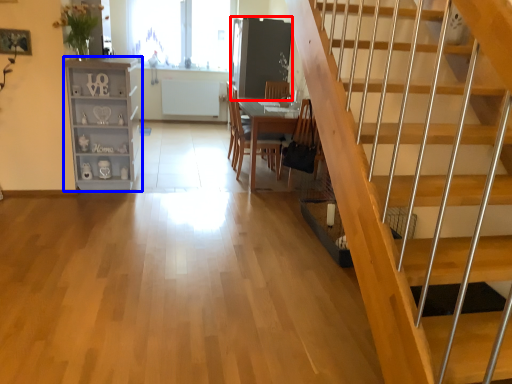
Question: Which of the following is the closest to the observer, glass door (highlighted by a red box) or shelf (highlighted by a blue box)?

Choices:
 (A) glass door
 (B) shelf

Answer: (B)